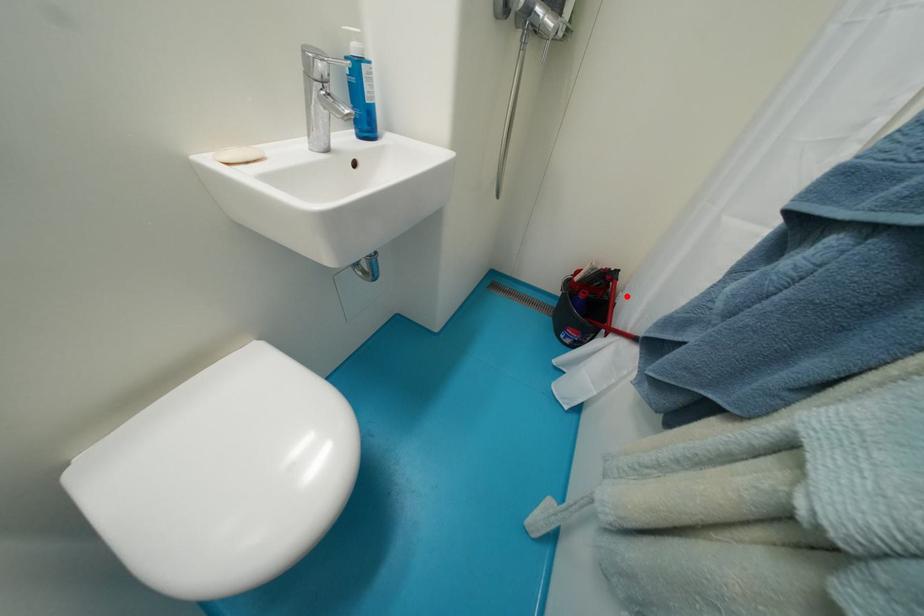
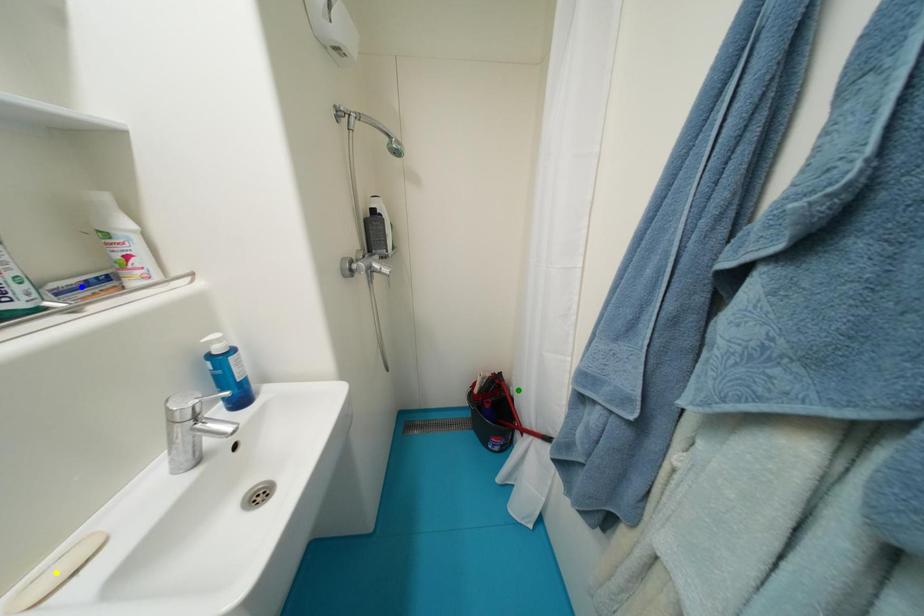
Question: I am providing you with two images of the same scene from different viewpoints. A red point is marked on the first image. You are given multiple points on the second image. Can you choose the point in image 2 that corresponds to the point in image 1?

Choices:
 (A) blue point
 (B) yellow point
 (C) green point

Answer: (C)